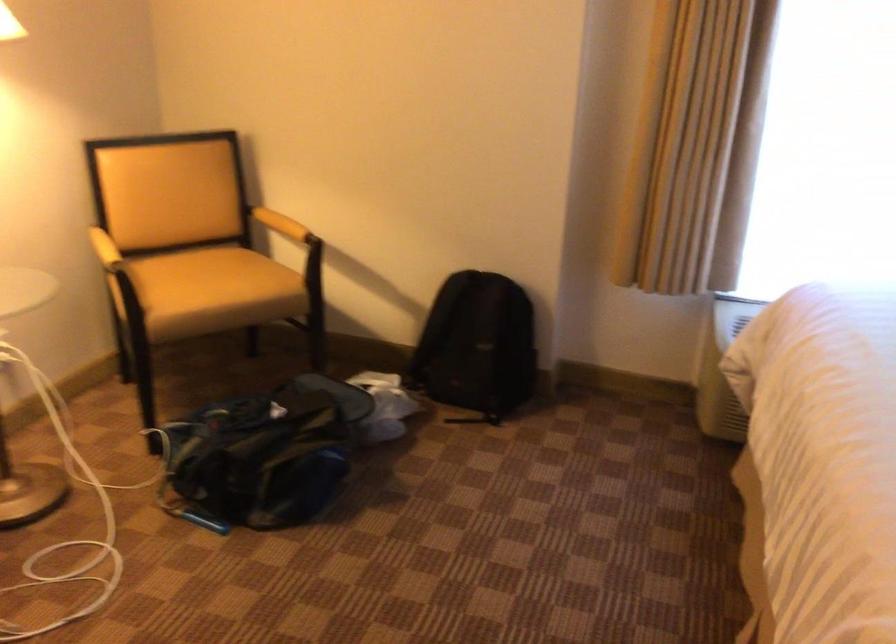
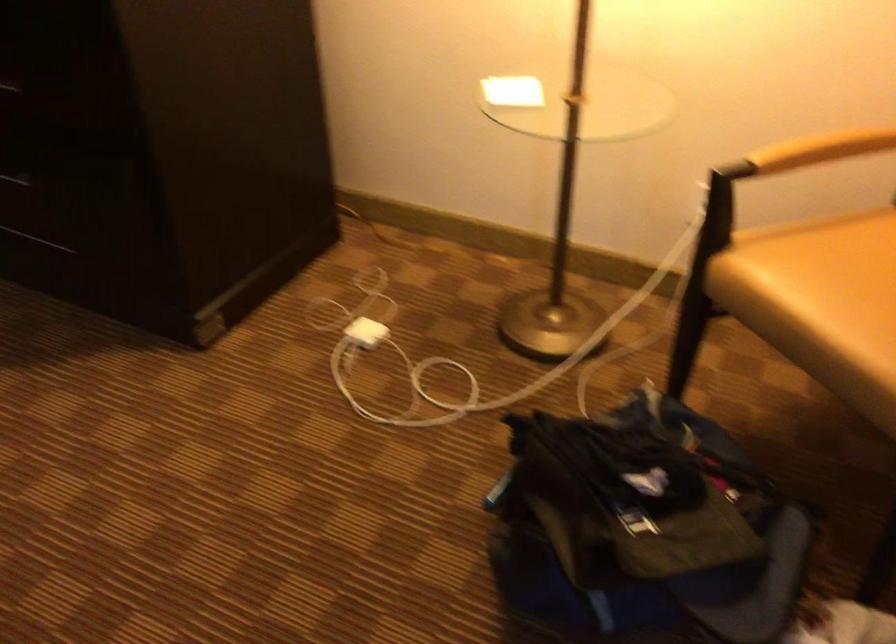
Find the pixel in the second image that matches point 227,292 in the first image.

(821, 303)